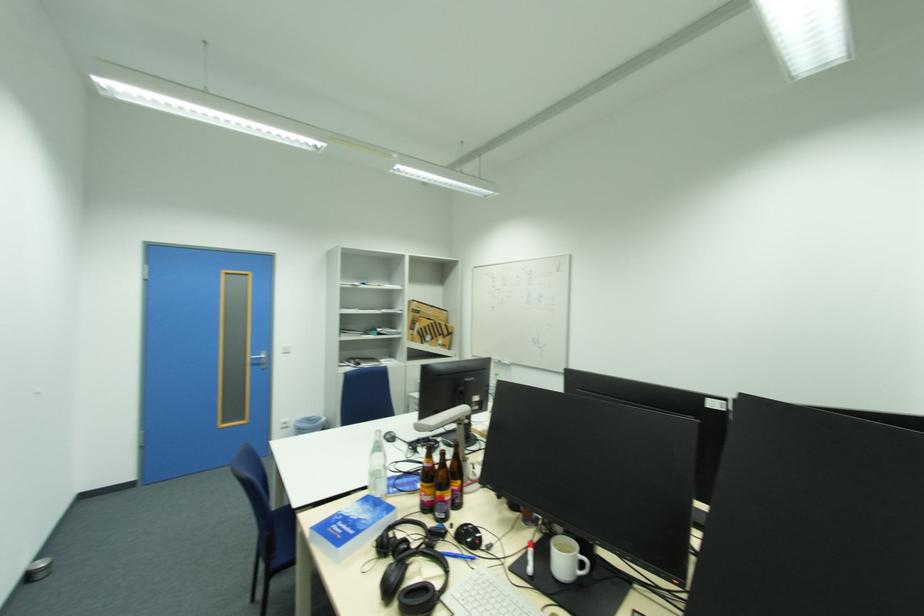
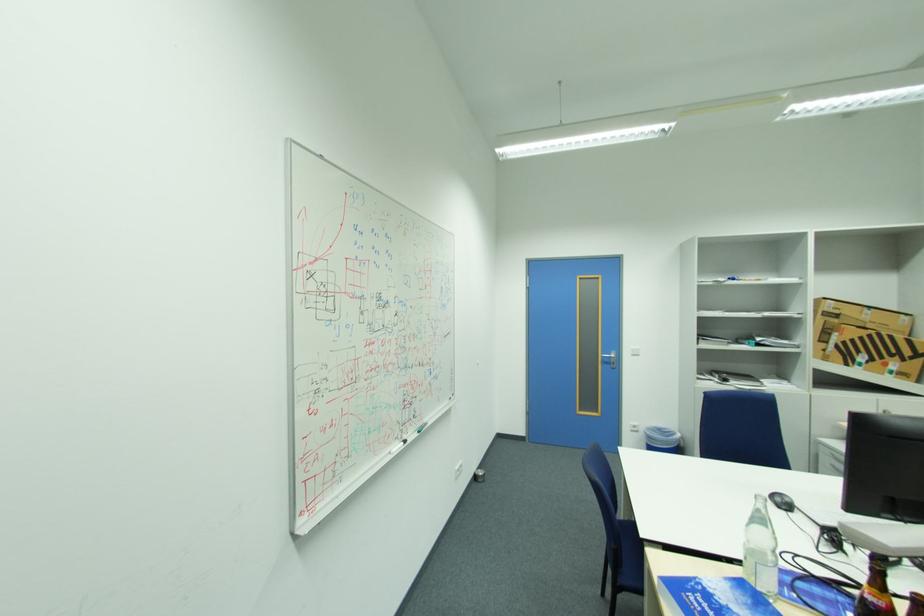
Question: The camera is either moving clockwise (left) or counter-clockwise (right) around the object. The first image is from the beginning of the video and the second image is from the end. Is the camera moving left or right when shooting the video?

Choices:
 (A) Left
 (B) Right

Answer: (B)